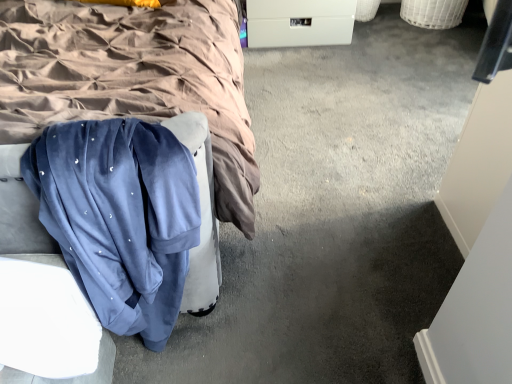
In order to face white plastic drawer at center, should I rotate leftwards or rightwards?

Rotate right and turn 5.172 degrees.

The width and height of the screenshot is (512, 384). I want to click on velvet blue blanket at center, so click(x=132, y=78).

Describe the element at coordinates (132, 78) in the screenshot. I see `velvet blue blanket at center` at that location.

At what (x,y) coordinates should I click in order to perform the action: click on white plastic drawer at center. Please return your answer as a coordinate pair (x, y). This screenshot has width=512, height=384. Looking at the image, I should click on (298, 22).

Does velvet blue sweatpants at lower left have a greater height compared to velvet blue blanket at center?

Incorrect, the height of velvet blue sweatpants at lower left is not larger of that of velvet blue blanket at center.

The height and width of the screenshot is (384, 512). In order to click on furniture on the right of velvet blue blanket at center in this screenshot , I will do `click(41, 297)`.

Is velvet blue sweatpants at lower left further to camera compared to velvet blue blanket at center?

Yes, velvet blue sweatpants at lower left is behind velvet blue blanket at center.

Measure the distance between velvet blue sweatpants at lower left and white plastic drawer at center.

velvet blue sweatpants at lower left is 6.13 feet away from white plastic drawer at center.

Where is `furniture in front of the white plastic drawer at center`? The image size is (512, 384). furniture in front of the white plastic drawer at center is located at coordinates (41, 297).

Is white plastic drawer at center inside velvet blue sweatpants at lower left?

No.

Does point (26, 363) come in front of point (248, 21)?

Yes, it is.

In the scene shown: Is velvet blue blanket at center in front of or behind white plastic drawer at center in the image?

velvet blue blanket at center is positioned closer to the viewer than white plastic drawer at center.

Who is shorter, velvet blue blanket at center or white plastic drawer at center?

With less height is white plastic drawer at center.

Would you consider velvet blue blanket at center to be distant from white plastic drawer at center?

No, velvet blue blanket at center is not far from white plastic drawer at center.

Consider the image. Which of these two, velvet blue blanket at center or white plastic drawer at center, is bigger?

velvet blue blanket at center.

Are velvet blue blanket at center and velvet blue sweatpants at lower left beside each other?

No, velvet blue blanket at center is not with velvet blue sweatpants at lower left.

Would you say velvet blue blanket at center is outside velvet blue sweatpants at lower left?

Yes, velvet blue blanket at center is not within velvet blue sweatpants at lower left.

From the picture: In the image, is velvet blue blanket at center positioned in front of or behind velvet blue sweatpants at lower left?

velvet blue blanket at center is positioned closer to the viewer than velvet blue sweatpants at lower left.

Does velvet blue blanket at center have a lesser width compared to velvet blue sweatpants at lower left?

No, velvet blue blanket at center is not thinner than velvet blue sweatpants at lower left.

Which object is more forward, white plastic drawer at center or velvet blue sweatpants at lower left?

Positioned in front is velvet blue sweatpants at lower left.

Is white plastic drawer at center positioned with its back to velvet blue sweatpants at lower left?

No, velvet blue sweatpants at lower left is not at the back of white plastic drawer at center.

Is white plastic drawer at center located outside velvet blue sweatpants at lower left?

That's correct, white plastic drawer at center is outside of velvet blue sweatpants at lower left.

Would you consider white plastic drawer at center to be distant from velvet blue sweatpants at lower left?

That's right, there is a large distance between white plastic drawer at center and velvet blue sweatpants at lower left.

Is white plastic drawer at center oriented towards velvet blue blanket at center?

No.

Considering the relative sizes of white plastic drawer at center and velvet blue blanket at center in the image provided, is white plastic drawer at center taller than velvet blue blanket at center?

No, white plastic drawer at center is not taller than velvet blue blanket at center.

Is white plastic drawer at center behind velvet blue blanket at center?

Yes, white plastic drawer at center is behind velvet blue blanket at center.

Is white plastic drawer at center next to velvet blue blanket at center and touching it?

No, white plastic drawer at center is not in contact with velvet blue blanket at center.

Where is `furniture below the velvet blue blanket at center (from the image's perspective)`? The width and height of the screenshot is (512, 384). furniture below the velvet blue blanket at center (from the image's perspective) is located at coordinates (41, 297).

At what (x,y) coordinates should I click in order to perform the action: click on drawer above the velvet blue sweatpants at lower left (from the image's perspective). Please return your answer as a coordinate pair (x, y). Image resolution: width=512 pixels, height=384 pixels. Looking at the image, I should click on (298, 22).

Based on their spatial positions, is velvet blue blanket at center or velvet blue sweatpants at lower left closer to white plastic drawer at center?

Based on the image, velvet blue blanket at center appears to be nearer to white plastic drawer at center.

Estimate the real-world distances between objects in this image. Which object is closer to velvet blue sweatpants at lower left, white plastic drawer at center or velvet blue blanket at center?

The object closer to velvet blue sweatpants at lower left is velvet blue blanket at center.

Which object lies nearer to the anchor point white plastic drawer at center, velvet blue sweatpants at lower left or velvet blue blanket at center?

Based on the image, velvet blue blanket at center appears to be nearer to white plastic drawer at center.

Based on their spatial positions, is velvet blue sweatpants at lower left or white plastic drawer at center closer to velvet blue blanket at center?

Based on the image, velvet blue sweatpants at lower left appears to be nearer to velvet blue blanket at center.

Looking at the image, which one is located closer to velvet blue blanket at center, white plastic drawer at center or velvet blue sweatpants at lower left?

The object closer to velvet blue blanket at center is velvet blue sweatpants at lower left.

When comparing their distances from velvet blue sweatpants at lower left, does velvet blue blanket at center or white plastic drawer at center seem closer?

Among the two, velvet blue blanket at center is located nearer to velvet blue sweatpants at lower left.

Where is `furniture positioned between velvet blue blanket at center and white plastic drawer at center from near to far`? The width and height of the screenshot is (512, 384). furniture positioned between velvet blue blanket at center and white plastic drawer at center from near to far is located at coordinates (41, 297).